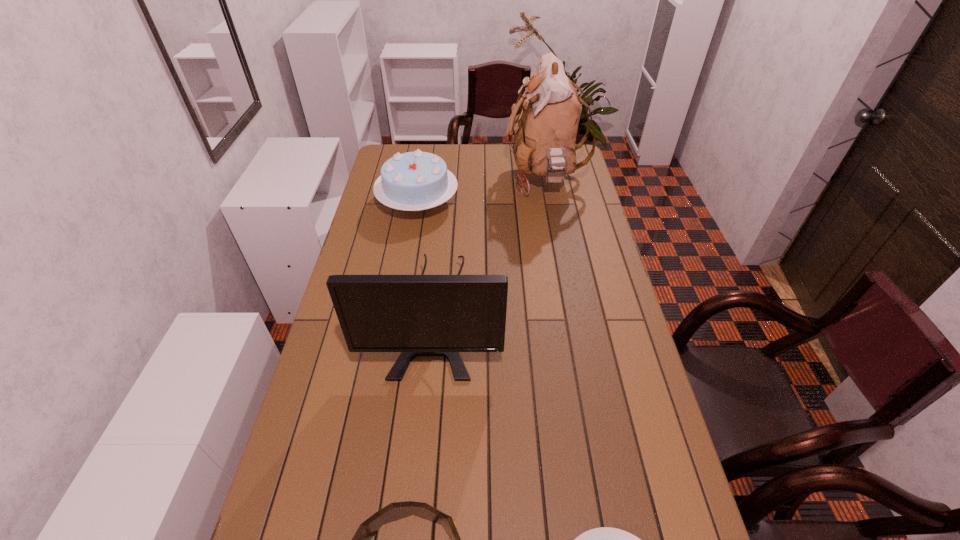
Find the location of a particular element. The height and width of the screenshot is (540, 960). computer monitor that is positioned at the left edge is located at coordinates (418, 315).

Where is `birthday cake at the left edge`? This screenshot has width=960, height=540. birthday cake at the left edge is located at coordinates (414, 181).

Find the location of `object that is positioned at the right edge`. object that is positioned at the right edge is located at coordinates (545, 131).

Identify the location of object that is at the far right corner. (545, 131).

Identify the location of vacant region at the far edge of the desktop. The image size is (960, 540). (444, 145).

This screenshot has width=960, height=540. Identify the location of free location at the left edge of the desktop. (385, 247).

Identify the location of vacant space at the right edge of the desktop. (593, 226).

Where is `unoccupied area between the second tallest object and the tallest object`? This screenshot has width=960, height=540. unoccupied area between the second tallest object and the tallest object is located at coordinates (490, 246).

The height and width of the screenshot is (540, 960). I want to click on free area in between the computer monitor and the tallest object, so click(490, 246).

Find the location of a particular element. This screenshot has width=960, height=540. free space between the third tallest object and the tallest object is located at coordinates (481, 191).